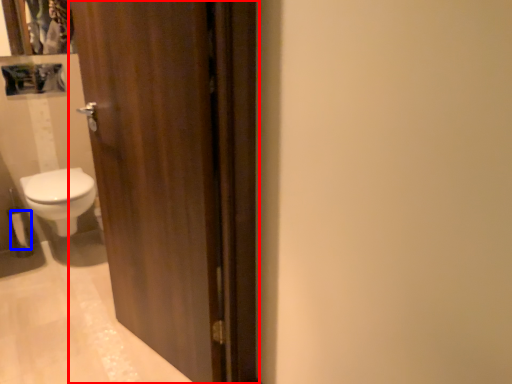
Question: Which object appears closest to the camera in this image, door (highlighted by a red box) or toilet paper (highlighted by a blue box)?

Choices:
 (A) door
 (B) toilet paper

Answer: (A)